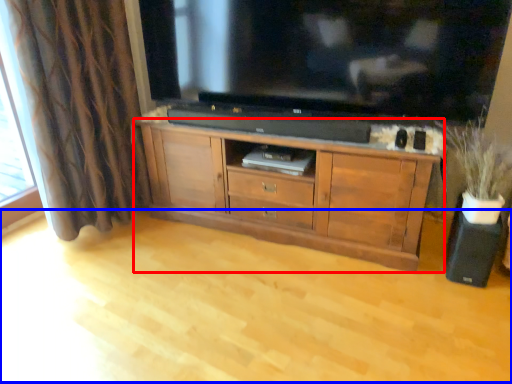
Question: Which point is closer to the camera, cabinetry (highlighted by a red box) or plain (highlighted by a blue box)?

Choices:
 (A) cabinetry
 (B) plain

Answer: (B)